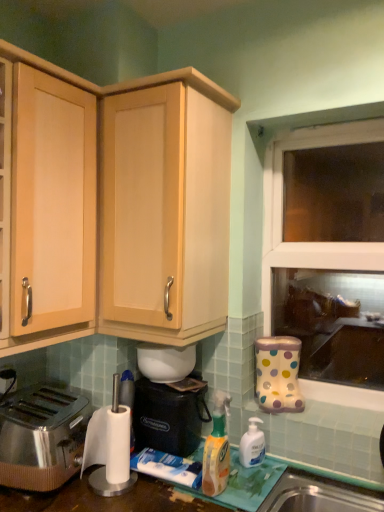
Question: Which is correct: white translucent pump bottle at lower center, the 2th bottle when ordered from front to back, is inside white glossy bowl at center, the second appliance in the bottom-to-top sequence, or outside of it?

Choices:
 (A) inside
 (B) outside

Answer: (B)

Question: Looking at their shapes, would you say white translucent pump bottle at lower center, the 1th bottle viewed from the back, is wider or thinner than white glossy bowl at center, the second appliance in the bottom-to-top sequence?

Choices:
 (A) thin
 (B) wide

Answer: (A)

Question: Which object is the closest to the transparent glass window at right?

Choices:
 (A) light wood cabinet at left, the 1th cabinetry viewed from the left
 (B) translucent plastic spray bottle at lower center, arranged as the 2th bottle when viewed from the right
 (C) white glossy bowl at center, placed as the first appliance when sorted from top to bottom
 (D) polished stainless steel toaster at lower left
 (E) black plastic trash can at lower center, the 2th appliance positioned from the top

Answer: (E)

Question: Estimate the real-world distances between objects in this image. Which object is closer to the light wood cabinet at upper center, which appears as the 2th cabinetry when viewed from the left?

Choices:
 (A) transparent glass window at right
 (B) polished stainless steel toaster at lower left
 (C) translucent plastic spray bottle at lower center, placed as the 2th bottle when sorted from back to front
 (D) black plastic trash can at lower center, acting as the 1th appliance starting from the bottom
 (E) white translucent pump bottle at lower center, marked as the second bottle in a left-to-right arrangement

Answer: (D)